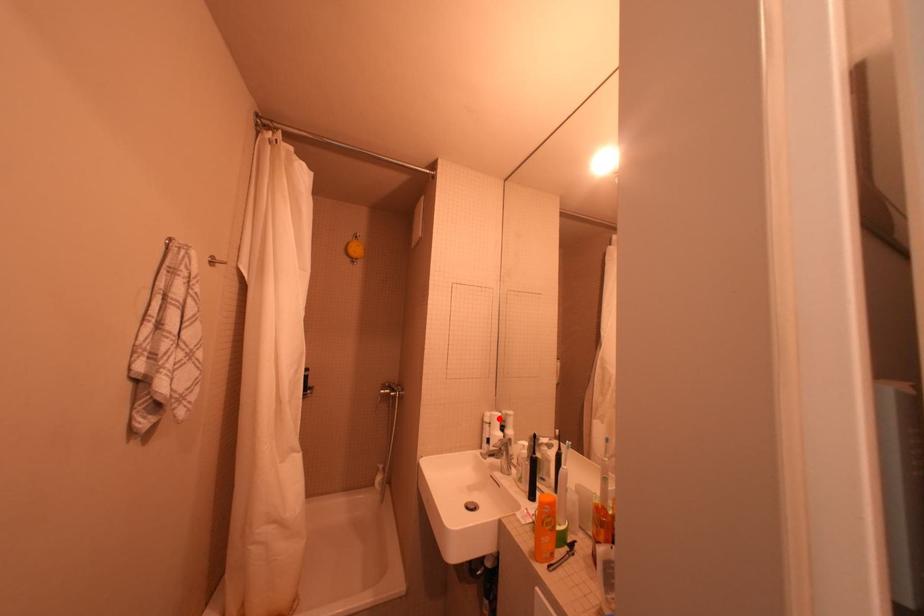
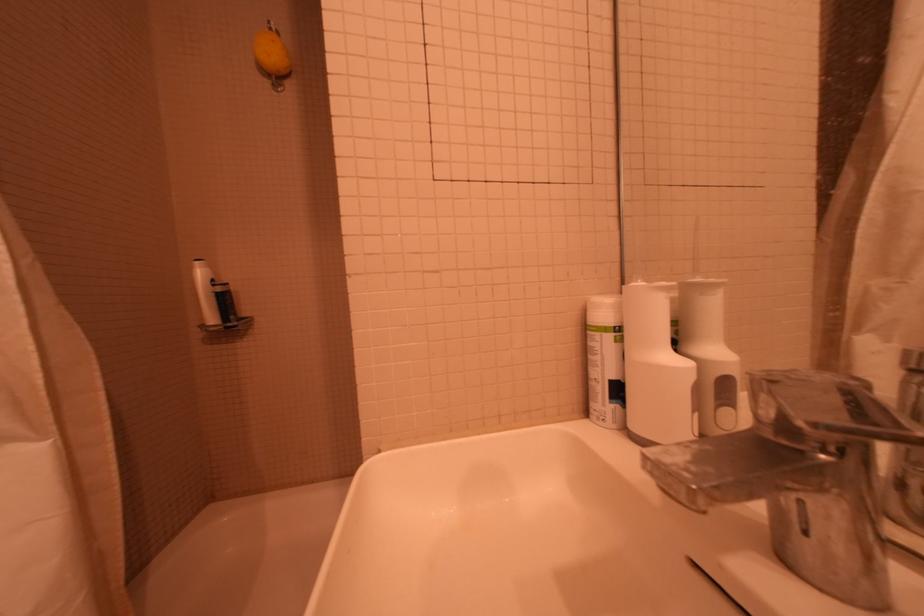
Where in the second image is the point corresponding to the highlighted location from the first image?

(627, 309)